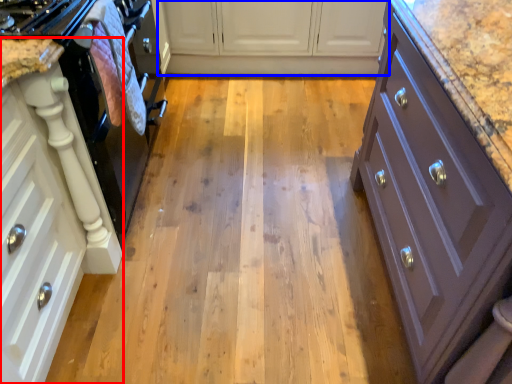
Question: Which object appears closest to the camera in this image, cabinetry (highlighted by a red box) or cabinetry (highlighted by a blue box)?

Choices:
 (A) cabinetry
 (B) cabinetry

Answer: (A)